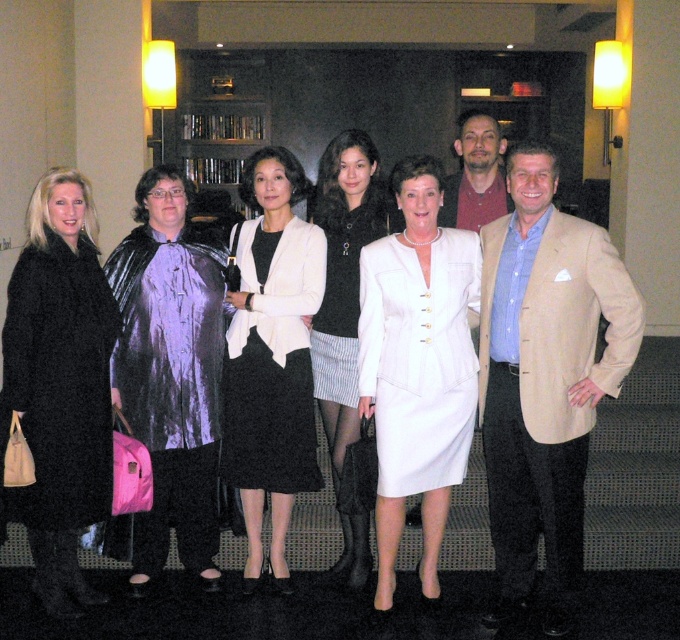
Question: Which point is closer to the camera?

Choices:
 (A) black wool coat at left
 (B) matte white blazer at center

Answer: (A)

Question: Is black wool coat at left in front of white satin dress at center?

Choices:
 (A) yes
 (B) no

Answer: (A)

Question: Is white satin suit at center bigger than white textured dress at center?

Choices:
 (A) yes
 (B) no

Answer: (A)

Question: Which point is farther from the camera taking this photo?

Choices:
 (A) click(320, 380)
 (B) click(488, 132)

Answer: (B)

Question: Which point appears closest to the camera in this image?

Choices:
 (A) pos(335,243)
 (B) pos(118,392)
 (C) pos(341,440)

Answer: (B)

Question: Can you confirm if tan fabric blazer at center is wider than metallic purple cape at center?

Choices:
 (A) yes
 (B) no

Answer: (A)